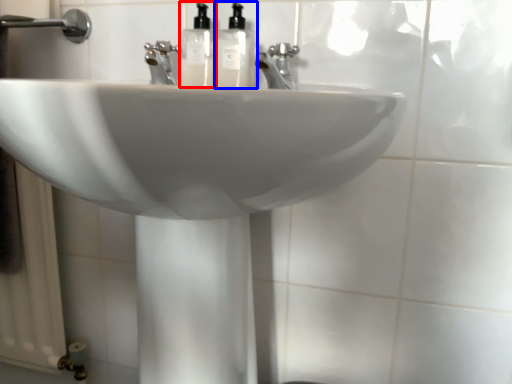
Question: Which object is closer to the camera taking this photo, soap dispenser (highlighted by a red box) or soap dispenser (highlighted by a blue box)?

Choices:
 (A) soap dispenser
 (B) soap dispenser

Answer: (B)